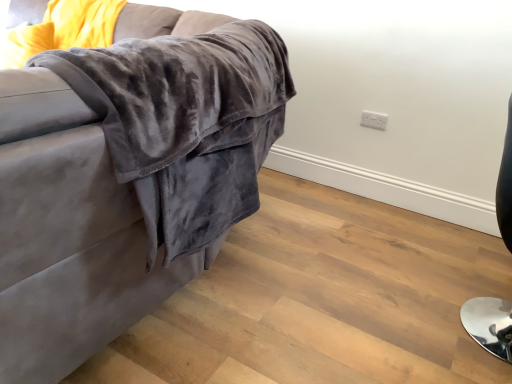
Question: From the image's perspective, is white plastic electric outlet at upper right located above shiny black chair at right?

Choices:
 (A) no
 (B) yes

Answer: (B)

Question: Is white plastic electric outlet at upper right far away from shiny black chair at right?

Choices:
 (A) yes
 (B) no

Answer: (A)

Question: From a real-world perspective, is white plastic electric outlet at upper right under shiny black chair at right?

Choices:
 (A) yes
 (B) no

Answer: (B)

Question: From a real-world perspective, is white plastic electric outlet at upper right located higher than shiny black chair at right?

Choices:
 (A) no
 (B) yes

Answer: (B)

Question: Does white plastic electric outlet at upper right lie behind shiny black chair at right?

Choices:
 (A) yes
 (B) no

Answer: (A)

Question: Does white plastic electric outlet at upper right have a smaller size compared to shiny black chair at right?

Choices:
 (A) yes
 (B) no

Answer: (A)

Question: Can you confirm if velvet gray couch at upper left is shorter than white plastic electric outlet at upper right?

Choices:
 (A) yes
 (B) no

Answer: (B)

Question: From a real-world perspective, is velvet gray couch at upper left below white plastic electric outlet at upper right?

Choices:
 (A) yes
 (B) no

Answer: (B)

Question: Can you confirm if velvet gray couch at upper left is bigger than white plastic electric outlet at upper right?

Choices:
 (A) yes
 (B) no

Answer: (A)

Question: Is the depth of velvet gray couch at upper left greater than that of white plastic electric outlet at upper right?

Choices:
 (A) yes
 (B) no

Answer: (B)

Question: From a real-world perspective, is velvet gray couch at upper left physically above white plastic electric outlet at upper right?

Choices:
 (A) no
 (B) yes

Answer: (B)

Question: From the image's perspective, is velvet gray couch at upper left on white plastic electric outlet at upper right?

Choices:
 (A) yes
 (B) no

Answer: (A)

Question: Is shiny black chair at right not within velvet gray couch at upper left?

Choices:
 (A) no
 (B) yes

Answer: (B)